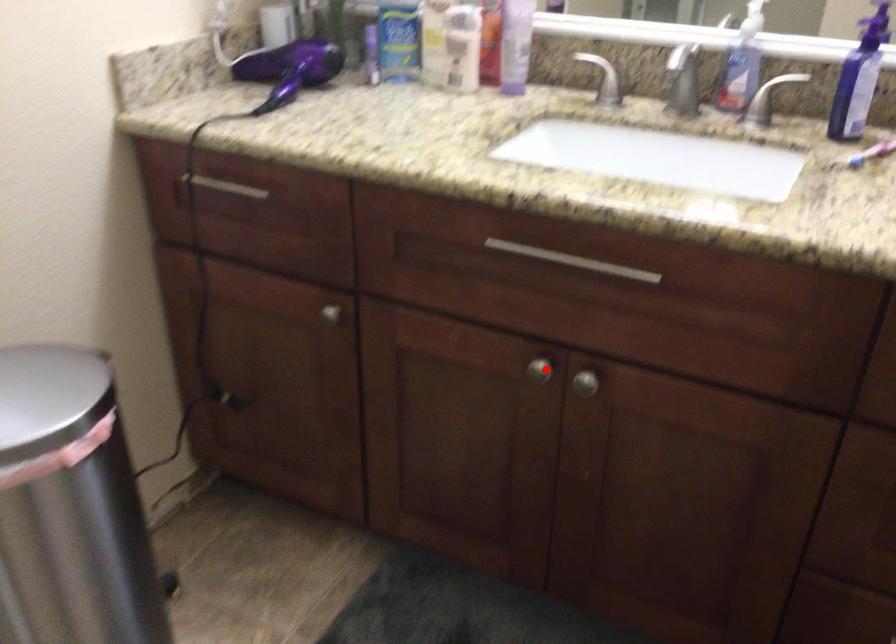
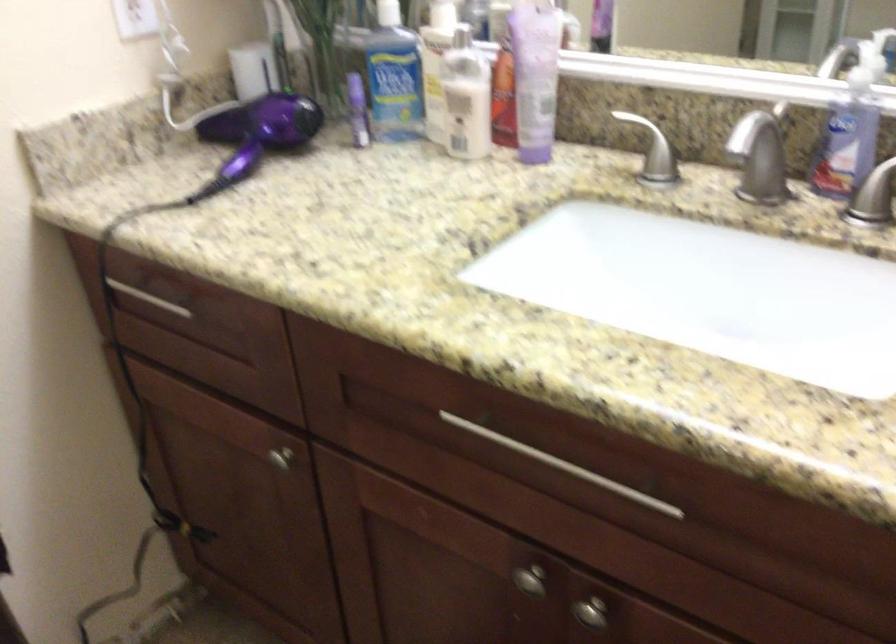
Question: I am providing you with two images of the same scene from different viewpoints. Given a red point in image1, look at the same physical point in image2. Is it:

Choices:
 (A) Closer to the viewpoint
 (B) Farther from the viewpoint

Answer: (A)